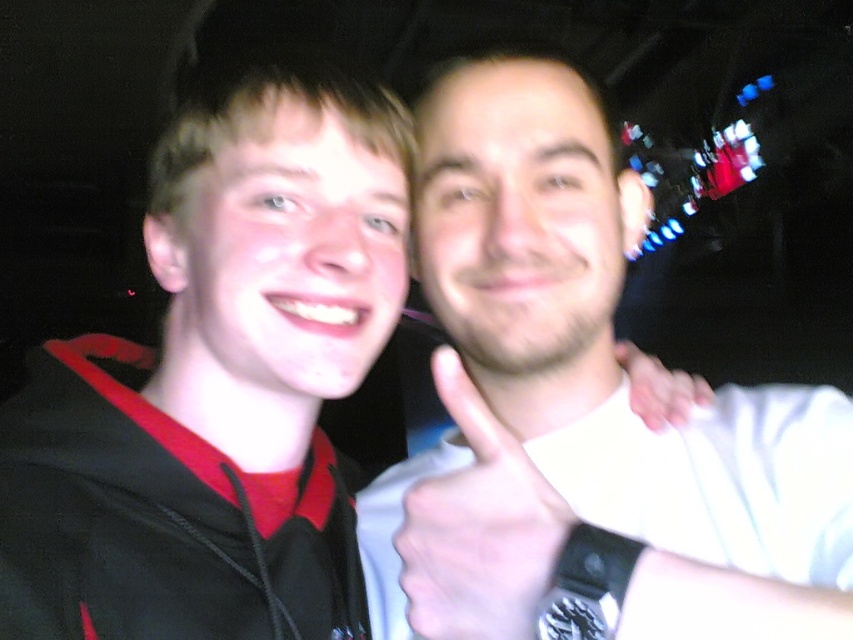
Question: Can you confirm if white matte shirt at upper right is positioned to the right of white matte hand at upper right?

Choices:
 (A) no
 (B) yes

Answer: (A)

Question: Can you confirm if white matte shirt at upper right is wider than white matte hand at upper right?

Choices:
 (A) yes
 (B) no

Answer: (A)

Question: Is the position of white matte shirt at upper right less distant than that of white matte hand at center?

Choices:
 (A) no
 (B) yes

Answer: (B)

Question: Among these objects, which one is nearest to the camera?

Choices:
 (A) white matte shirt at upper right
 (B) white matte hand at upper right
 (C) white matte hand at center

Answer: (A)

Question: Estimate the real-world distances between objects in this image. Which object is closer to the white matte shirt at upper right?

Choices:
 (A) white matte hand at center
 (B) white matte hand at upper right

Answer: (A)

Question: Which point is closer to the camera?

Choices:
 (A) white matte hand at center
 (B) white matte hand at upper right

Answer: (A)